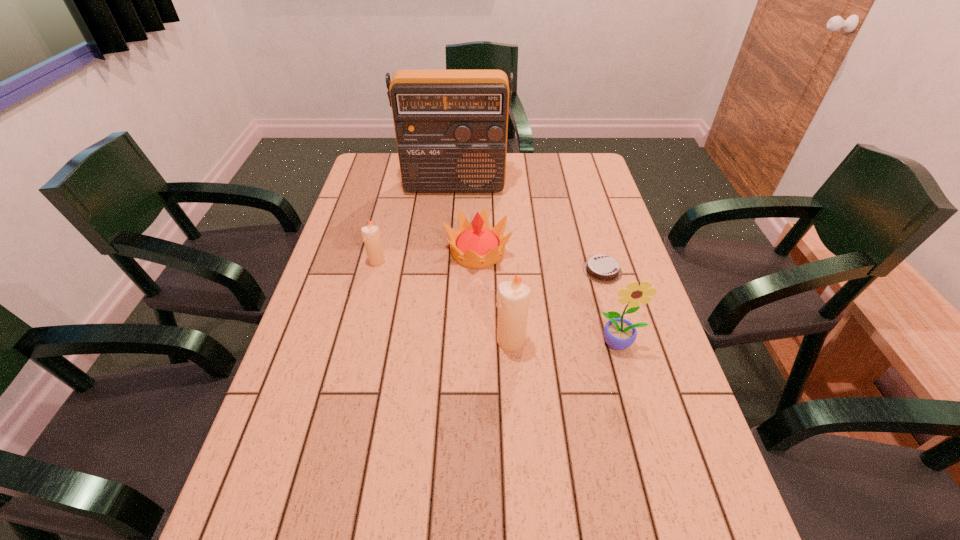
Locate an element on the screen. Image resolution: width=960 pixels, height=540 pixels. object present at the far left corner is located at coordinates pos(451,126).

Locate an element on the screen. The height and width of the screenshot is (540, 960). free space at the near edge is located at coordinates point(424,464).

Where is `blank space at the left edge`? blank space at the left edge is located at coordinates (353, 330).

Identify the location of free region at the right edge. (636, 415).

Identify the location of free space at the far left corner of the desktop. (396, 185).

The width and height of the screenshot is (960, 540). Identify the location of vacant region at the far right corner of the desktop. (573, 186).

Where is `free space between the chocolate cake and the nearer candle`? free space between the chocolate cake and the nearer candle is located at coordinates (557, 306).

Find the location of `empty space between the shortest object and the sunflower`. empty space between the shortest object and the sunflower is located at coordinates (611, 307).

The width and height of the screenshot is (960, 540). Identify the location of vacant region between the radio receiver and the sunflower. (537, 265).

What are the coordinates of `unoccupied position between the chocolate cake and the crown` in the screenshot? It's located at (540, 261).